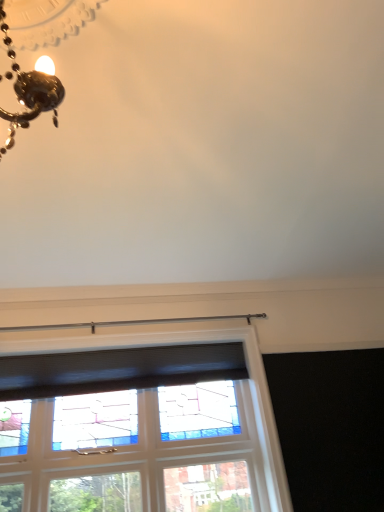
Question: Considering the relative sizes of stained glass window at center and black mesh curtain at upper center in the image provided, is stained glass window at center bigger than black mesh curtain at upper center?

Choices:
 (A) yes
 (B) no

Answer: (A)

Question: Can you confirm if stained glass window at center is smaller than black mesh curtain at upper center?

Choices:
 (A) yes
 (B) no

Answer: (B)

Question: Is stained glass window at center aimed at black mesh curtain at upper center?

Choices:
 (A) no
 (B) yes

Answer: (B)

Question: Are stained glass window at center and black mesh curtain at upper center far apart?

Choices:
 (A) no
 (B) yes

Answer: (A)

Question: Could black mesh curtain at upper center be considered to be inside stained glass window at center?

Choices:
 (A) yes
 (B) no

Answer: (B)

Question: From the image's perspective, is stained glass window at center on black mesh curtain at upper center?

Choices:
 (A) yes
 (B) no

Answer: (B)

Question: Could you tell me if black mesh curtain at upper center is turned towards stained glass window at center?

Choices:
 (A) yes
 (B) no

Answer: (A)

Question: From the image's perspective, is black mesh curtain at upper center beneath stained glass window at center?

Choices:
 (A) yes
 (B) no

Answer: (B)

Question: Is black mesh curtain at upper center bigger than stained glass window at center?

Choices:
 (A) yes
 (B) no

Answer: (B)

Question: Is black mesh curtain at upper center located outside stained glass window at center?

Choices:
 (A) yes
 (B) no

Answer: (A)

Question: From the image's perspective, is black mesh curtain at upper center above stained glass window at center?

Choices:
 (A) no
 (B) yes

Answer: (B)

Question: Is black mesh curtain at upper center positioned behind stained glass window at center?

Choices:
 (A) no
 (B) yes

Answer: (B)

Question: From a real-world perspective, is black mesh curtain at upper center above or below stained glass window at center?

Choices:
 (A) above
 (B) below

Answer: (A)